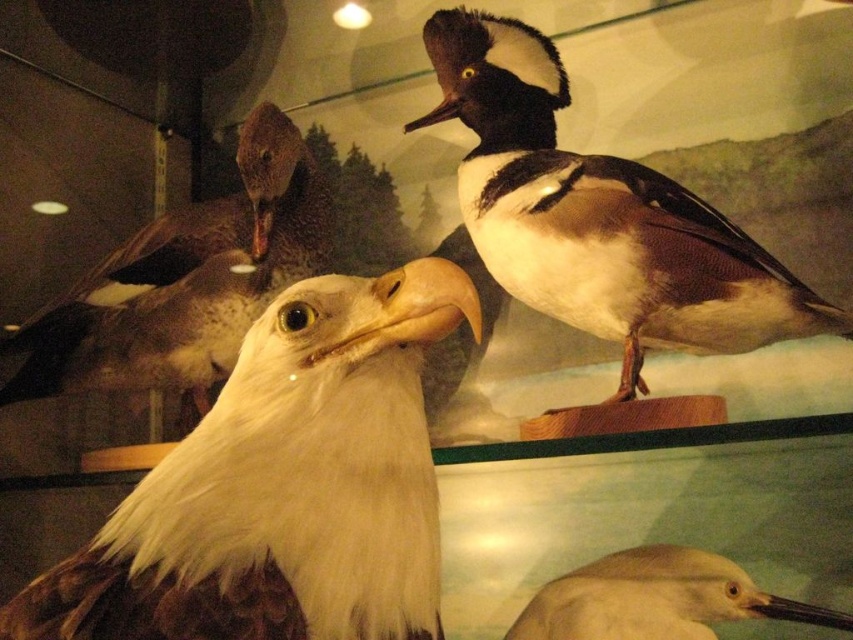
Question: Among these points, which one is nearest to the camera?

Choices:
 (A) (265, 321)
 (B) (103, 340)

Answer: (A)

Question: Can you confirm if brown-feathered duck at upper right is wider than white matte bald eagle at upper left?

Choices:
 (A) no
 (B) yes

Answer: (B)

Question: Does brown-feathered duck at upper right appear over white matte snowy egret at lower right?

Choices:
 (A) no
 (B) yes

Answer: (B)

Question: Considering the relative positions of brown-feathered duck at upper right and white matte snowy egret at lower right in the image provided, where is brown-feathered duck at upper right located with respect to white matte snowy egret at lower right?

Choices:
 (A) above
 (B) below

Answer: (A)

Question: Which point is farther to the camera?

Choices:
 (A) brown-feathered duck at upper right
 (B) white matte snowy egret at lower right

Answer: (B)

Question: Which point is closer to the camera?

Choices:
 (A) white matte bald eagle at upper left
 (B) white matte snowy egret at lower right
 (C) white feathered eagle at center

Answer: (C)